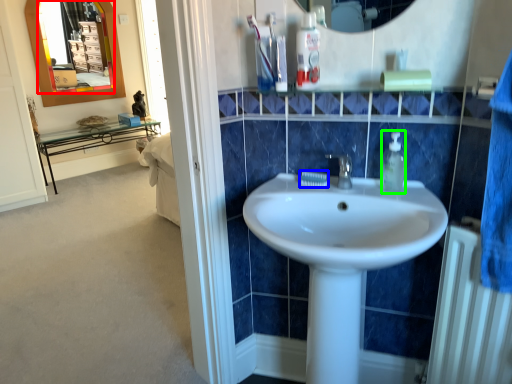
Question: Considering the real-world distances, which object is closest to mirror (highlighted by a red box)? toothpaste (highlighted by a blue box) or soap dispenser (highlighted by a green box).

Choices:
 (A) toothpaste
 (B) soap dispenser

Answer: (A)